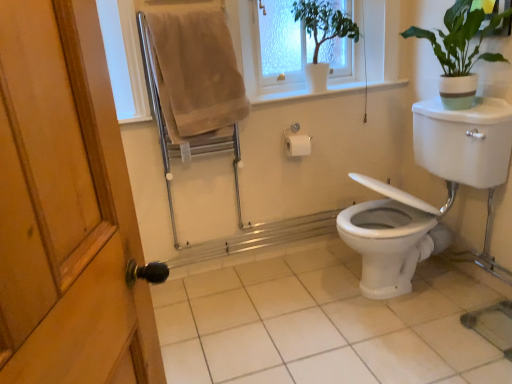
Where is `green matte plant at upper right, the second houseplant from the left`? green matte plant at upper right, the second houseplant from the left is located at coordinates (460, 51).

You are a GUI agent. You are given a task and a screenshot of the screen. Output one action in this format:
    pyautogui.click(x=<x>, y=<y>)
    Task: Click on the beige cotton towel at upper left
    Image resolution: width=512 pixels, height=384 pixels.
    Given the screenshot: What is the action you would take?
    pyautogui.click(x=196, y=74)

The width and height of the screenshot is (512, 384). I want to click on white glossy toilet at lower right, so pyautogui.click(x=459, y=156).

What's the angular difference between green matte plant at upper right, acting as the 1th houseplant starting from the right, and white glossy tile at center's facing directions?

The angle between the facing direction of green matte plant at upper right, acting as the 1th houseplant starting from the right, and the facing direction of white glossy tile at center is 88.9 degrees.

In order to click on tile directly beneath the green matte plant at upper right, the second houseplant from the left (from a real-world perspective) in this screenshot , I will do pos(324,324).

From a real-world perspective, is green matte plant at upper right, the second houseplant from the left, physically above white glossy tile at center?

Yes, from a real-world perspective, green matte plant at upper right, the second houseplant from the left, is over white glossy tile at center

In the image, is green matte plant at upper right, acting as the 1th houseplant starting from the right, on the left side or the right side of white glossy tile at center?

In the image, green matte plant at upper right, acting as the 1th houseplant starting from the right, appears on the right side of white glossy tile at center.

Is white glossy toilet at lower right oriented away from beige cotton towel at upper left?

No, beige cotton towel at upper left is not at the back of white glossy toilet at lower right.

Considering the relative sizes of white glossy toilet at lower right and beige cotton towel at upper left in the image provided, is white glossy toilet at lower right taller than beige cotton towel at upper left?

Indeed, white glossy toilet at lower right has a greater height compared to beige cotton towel at upper left.

Is point (459, 117) positioned behind point (170, 90)?

No, (459, 117) is in front of (170, 90).

Based on the photo, which object is closer to the camera, white glossy toilet at lower right or beige cotton towel at upper left?

Positioned in front is white glossy toilet at lower right.

Which is further, [169,23] or [473,367]?

Positioned behind is point [169,23].

Which of these two, beige cotton towel at upper left or white glossy tile at center, stands shorter?

white glossy tile at center is shorter.

Considering the positions of objects beige cotton towel at upper left and white glossy tile at center in the image provided, who is behind, beige cotton towel at upper left or white glossy tile at center?

Positioned behind is beige cotton towel at upper left.

From the image's perspective, between beige cotton towel at upper left and white glossy tile at center, who is located below?

white glossy tile at center is shown below in the image.

Which is less distant, (338, 25) or (452, 13)?

Point (338, 25) appears to be farther away from the viewer than point (452, 13).

You are a GUI agent. You are given a task and a screenshot of the screen. Output one action in this format:
    pyautogui.click(x=<x>, y=<y>)
    Task: Click on the houseplant on the left of the green matte plant at upper right, the second houseplant from the left
    Image resolution: width=512 pixels, height=384 pixels.
    Given the screenshot: What is the action you would take?
    [x=322, y=35]

Considering the relative sizes of white glossy pot at upper center, positioned as the 1th houseplant in left-to-right order, and green matte plant at upper right, acting as the 1th houseplant starting from the right, in the image provided, is white glossy pot at upper center, positioned as the 1th houseplant in left-to-right order, smaller than green matte plant at upper right, acting as the 1th houseplant starting from the right,?

Indeed, white glossy pot at upper center, positioned as the 1th houseplant in left-to-right order, has a smaller size compared to green matte plant at upper right, acting as the 1th houseplant starting from the right.

Is green matte plant at upper right, acting as the 1th houseplant starting from the right, aimed at beige cotton towel at upper left?

Yes, green matte plant at upper right, acting as the 1th houseplant starting from the right, is oriented towards beige cotton towel at upper left.

Does point (450, 58) come closer to viewer compared to point (221, 114)?

Yes, point (450, 58) is in front of point (221, 114).

From a real-world perspective, who is located lower, green matte plant at upper right, the second houseplant from the left, or beige cotton towel at upper left?

In real-world perspective, beige cotton towel at upper left is lower.

Considering the relative positions of green matte plant at upper right, the second houseplant from the left, and beige cotton towel at upper left in the image provided, is green matte plant at upper right, the second houseplant from the left, in front of beige cotton towel at upper left?

Yes, the depth of green matte plant at upper right, the second houseplant from the left, is less than that of beige cotton towel at upper left.

Which object is positioned more to the right, white glossy pot at upper center, positioned as the 1th houseplant in left-to-right order, or white plastic window frame at upper center?

white glossy pot at upper center, positioned as the 1th houseplant in left-to-right order.

Is white plastic window frame at upper center at the back of white glossy pot at upper center, the second houseplant from the right?

Yes, white glossy pot at upper center, the second houseplant from the right,'s orientation is away from white plastic window frame at upper center.

Relative to white plastic window frame at upper center, is white glossy pot at upper center, positioned as the 1th houseplant in left-to-right order, in front or behind?

Visually, white glossy pot at upper center, positioned as the 1th houseplant in left-to-right order, is located behind white plastic window frame at upper center.

Which is less distant, (207, 64) or (267, 97)?

Point (207, 64) is closer to the camera than point (267, 97).

Considering the sizes of beige cotton towel at upper left and white plastic window frame at upper center in the image, is beige cotton towel at upper left taller or shorter than white plastic window frame at upper center?

Considering their sizes, beige cotton towel at upper left has more height than white plastic window frame at upper center.

From a real-world perspective, does beige cotton towel at upper left stand above white plastic window frame at upper center?

Actually, beige cotton towel at upper left is physically below white plastic window frame at upper center in the real world.

Considering the sizes of objects beige cotton towel at upper left and white plastic window frame at upper center in the image provided, who is thinner, beige cotton towel at upper left or white plastic window frame at upper center?

beige cotton towel at upper left.

I want to click on tile that appears below the green matte plant at upper right, the second houseplant from the left (from the image's perspective), so click(x=324, y=324).

Where is `bath towel above the white glossy toilet at lower right (from a real-world perspective)`? This screenshot has height=384, width=512. bath towel above the white glossy toilet at lower right (from a real-world perspective) is located at coordinates (196, 74).

Based on their spatial positions, is white glossy toilet at lower right or white plastic window frame at upper center closer to green matte plant at upper right, the second houseplant from the left?

white glossy toilet at lower right is closer to green matte plant at upper right, the second houseplant from the left.

When comparing their distances from white glossy tile at center, does white plastic window frame at upper center or green matte plant at upper right, the second houseplant from the left, seem further?

green matte plant at upper right, the second houseplant from the left, lies further to white glossy tile at center than the other object.

From the image, which object appears to be farther from white glossy toilet at lower right, white glossy tile at center or green matte plant at upper right, the second houseplant from the left?

white glossy tile at center lies further to white glossy toilet at lower right than the other object.

Which object lies further to the anchor point green matte plant at upper right, the second houseplant from the left, white glossy pot at upper center, the second houseplant from the right, or beige cotton towel at upper left?

beige cotton towel at upper left is further to green matte plant at upper right, the second houseplant from the left.

Which object lies further to the anchor point white glossy toilet at lower right, white plastic window frame at upper center or white glossy pot at upper center, positioned as the 1th houseplant in left-to-right order?

white glossy pot at upper center, positioned as the 1th houseplant in left-to-right order, lies further to white glossy toilet at lower right than the other object.

Based on their spatial positions, is white plastic window frame at upper center or white glossy toilet at lower right closer to white glossy tile at center?

white glossy toilet at lower right is closer to white glossy tile at center.

Estimate the real-world distances between objects in this image. Which object is further from white glossy pot at upper center, the second houseplant from the right, beige cotton towel at upper left or green matte plant at upper right, the second houseplant from the left?

The object further to white glossy pot at upper center, the second houseplant from the right, is beige cotton towel at upper left.

Considering their positions, is beige cotton towel at upper left positioned closer to white plastic window frame at upper center than white glossy toilet at lower right?

beige cotton towel at upper left is positioned closer to the anchor white plastic window frame at upper center.

Locate an element on the screen. bath towel between white glossy pot at upper center, the second houseplant from the right, and white glossy tile at center, in the vertical direction is located at coordinates (196, 74).

Find the location of a particular element. houseplant between white glossy pot at upper center, the second houseplant from the right, and white glossy tile at center in the up-down direction is located at coordinates (460, 51).

Find the location of a particular element. sink situated between beige cotton towel at upper left and green matte plant at upper right, the second houseplant from the left, from left to right is located at coordinates (459, 156).

In order to click on sink between green matte plant at upper right, acting as the 1th houseplant starting from the right, and white glossy tile at center, in the vertical direction in this screenshot , I will do `click(459, 156)`.